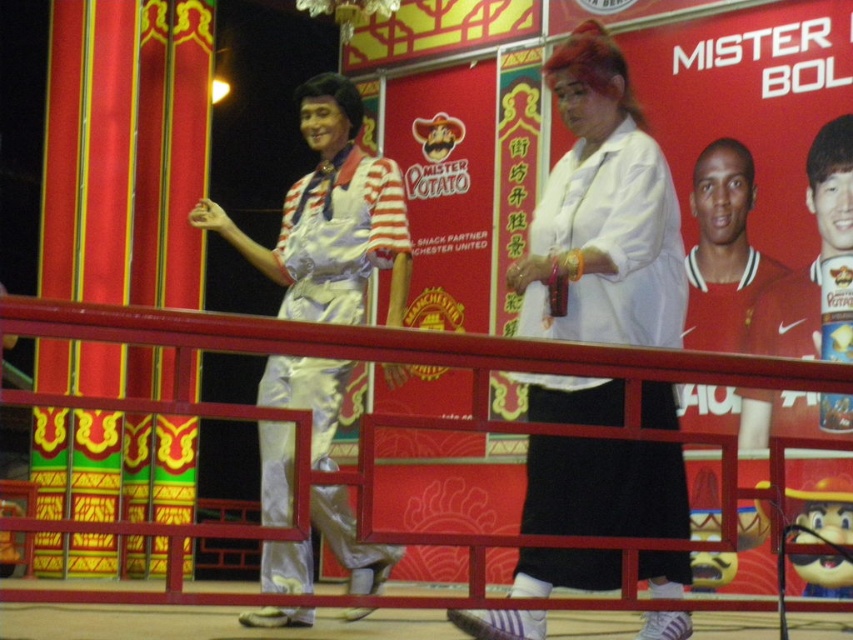
Can you confirm if metallic red railing at center is wider than shiny silver jumpsuit at left?

Yes, metallic red railing at center is wider than shiny silver jumpsuit at left.

Looking at this image, can you confirm if metallic red railing at center is smaller than shiny silver jumpsuit at left?

Yes, metallic red railing at center is smaller than shiny silver jumpsuit at left.

Is point (360, 534) positioned before point (372, 221)?

Yes, it is in front of point (372, 221).

This screenshot has width=853, height=640. What are the coordinates of `metallic red railing at center` in the screenshot? It's located at (398, 428).

Which is behind, point (308, 388) or point (747, 253)?

The point (747, 253) is more distant.

In the scene shown: Which is more to the left, shiny silver jumpsuit at left or red jersey at center?

shiny silver jumpsuit at left is more to the left.

In order to click on shiny silver jumpsuit at left in this screenshot , I will do `click(329, 218)`.

Locate an element on the screen. This screenshot has height=640, width=853. shiny silver jumpsuit at left is located at coordinates (329, 218).

Does point (682, 266) come behind point (399, 330)?

Yes, point (682, 266) is behind point (399, 330).

Is point (561, 184) less distant than point (387, 340)?

No, it is not.

Does point (573, 467) come in front of point (664, 372)?

No.

This screenshot has width=853, height=640. What are the coordinates of `white matte shirt at center` in the screenshot? It's located at [602, 214].